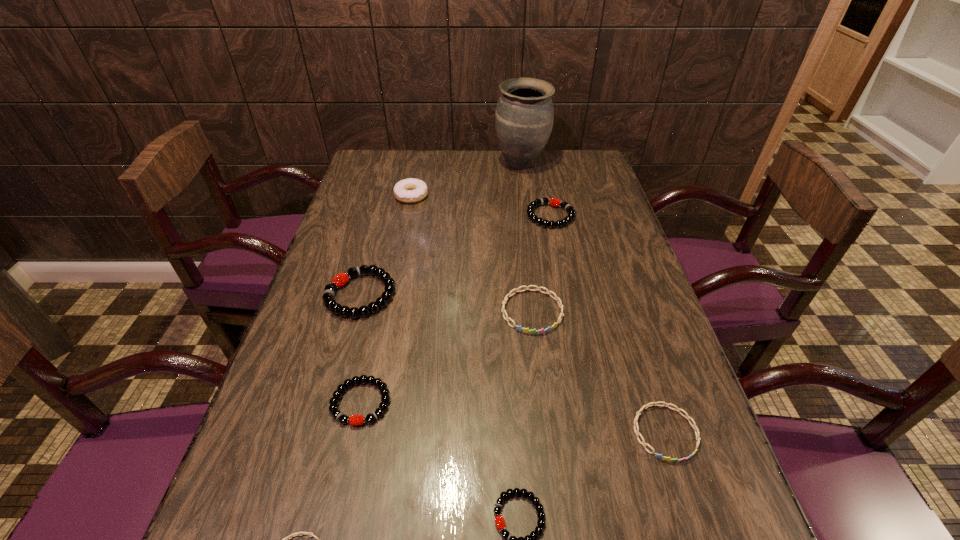
Find the location of a particular element. object that is at the far edge is located at coordinates (524, 117).

Where is `doughnut situated at the left edge`? This screenshot has height=540, width=960. doughnut situated at the left edge is located at coordinates (411, 190).

Where is `vacant space at the far edge of the desktop`? The image size is (960, 540). vacant space at the far edge of the desktop is located at coordinates (425, 153).

In the image, there is a desktop. Where is `vacant region at the left edge`? This screenshot has height=540, width=960. vacant region at the left edge is located at coordinates (321, 267).

This screenshot has height=540, width=960. What are the coordinates of `vacant space at the right edge` in the screenshot? It's located at (609, 377).

I want to click on free space at the far left corner, so click(370, 160).

I want to click on free space between the second nearest black bracelet and the farthest black bracelet, so click(x=456, y=309).

Where is `free space between the third farthest black bracelet and the farthest object`? This screenshot has width=960, height=540. free space between the third farthest black bracelet and the farthest object is located at coordinates (441, 283).

The image size is (960, 540). What are the coordinates of `free space between the urn and the tallest bracelet` in the screenshot? It's located at (441, 230).

Locate an element on the screen. Image resolution: width=960 pixels, height=540 pixels. unoccupied area between the second smallest blue bracelet and the farthest object is located at coordinates (593, 298).